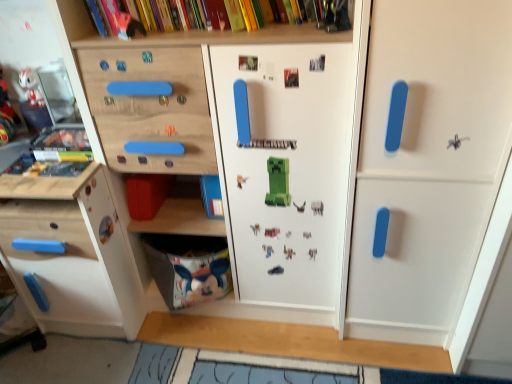
Question: Considering the relative positions of matte plastic rabbit at upper left and white matte door at right in the image provided, is matte plastic rabbit at upper left to the left of white matte door at right from the viewer's perspective?

Choices:
 (A) yes
 (B) no

Answer: (A)

Question: Is matte plastic rabbit at upper left looking in the opposite direction of white matte door at right?

Choices:
 (A) no
 (B) yes

Answer: (A)

Question: Does matte plastic rabbit at upper left have a lesser width compared to white matte door at right?

Choices:
 (A) yes
 (B) no

Answer: (A)

Question: Is matte plastic rabbit at upper left further to the viewer compared to white matte door at right?

Choices:
 (A) no
 (B) yes

Answer: (B)

Question: Is matte plastic rabbit at upper left next to white matte door at right?

Choices:
 (A) yes
 (B) no

Answer: (B)

Question: Considering the positions of matte plastic rabbit at upper left and white matte door at right in the image, is matte plastic rabbit at upper left taller or shorter than white matte door at right?

Choices:
 (A) tall
 (B) short

Answer: (B)

Question: Is point (28, 96) positioned closer to the camera than point (476, 167)?

Choices:
 (A) closer
 (B) farther

Answer: (B)

Question: Considering the positions of matte plastic rabbit at upper left and white matte door at right in the image, is matte plastic rabbit at upper left wider or thinner than white matte door at right?

Choices:
 (A) wide
 (B) thin

Answer: (B)

Question: Visually, is matte plastic rabbit at upper left positioned to the left or to the right of white matte door at right?

Choices:
 (A) right
 (B) left

Answer: (B)

Question: From the image's perspective, is white matte door at right located above or below matte plastic rabbit at upper left?

Choices:
 (A) above
 (B) below

Answer: (B)

Question: Considering the positions of white matte door at right and matte plastic rabbit at upper left in the image, is white matte door at right taller or shorter than matte plastic rabbit at upper left?

Choices:
 (A) tall
 (B) short

Answer: (A)

Question: From a real-world perspective, is white matte door at right positioned above or below matte plastic rabbit at upper left?

Choices:
 (A) below
 (B) above

Answer: (A)

Question: Considering their positions, is white matte door at right located in front of or behind matte plastic rabbit at upper left?

Choices:
 (A) front
 (B) behind

Answer: (A)

Question: Is matte plastic rabbit at upper left situated inside white fabric bag at lower center or outside?

Choices:
 (A) outside
 (B) inside

Answer: (A)

Question: In the image, is matte plastic rabbit at upper left positioned in front of or behind white fabric bag at lower center?

Choices:
 (A) front
 (B) behind

Answer: (B)